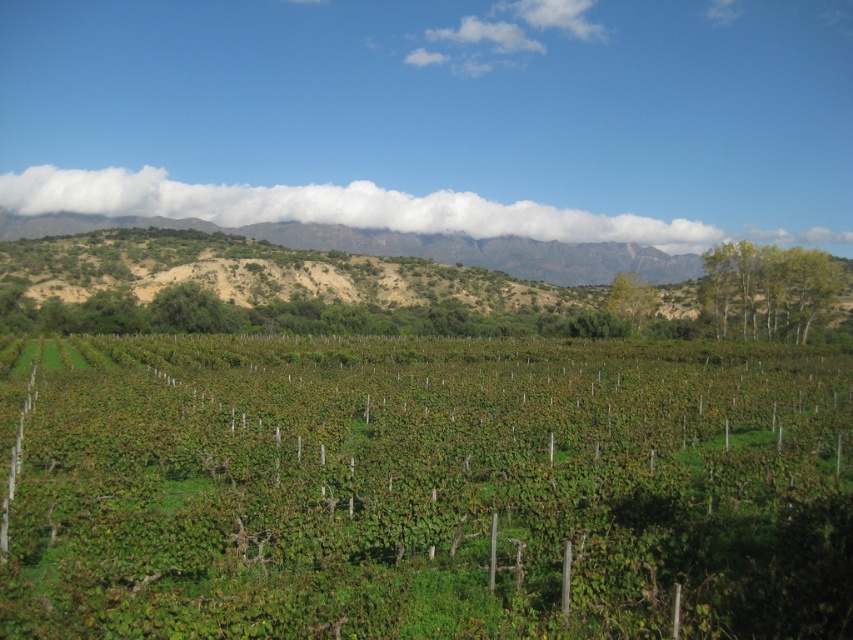
You are standing in the vineyard and want to reach a specific point marked at coordinates point [703,520]. If you start walking straight ahead from your current position, how far will you have to walk to reach that point?

The distance of point [703,520] from viewer is 42.21 feet, so you will have to walk 42.21 feet straight ahead to reach it.

You are a drone operator planning to capture aerial footage of the green leafy vineyard at center. The drone has a GPS coordinate system where the center of the image is at point 0.5, 0.5. To ensure the vineyard is centered in the frame, should you adjust the drone to move towards the left or right? Explain your reasoning based on the provided coordinates.

The green leafy vineyard at center is located at point [425,488] in the image. Since the center of the image is at [426,320], the vineyard is shifted to the right. To center it, the drone should move to the left to bring the vineyard back to the central coordinates.